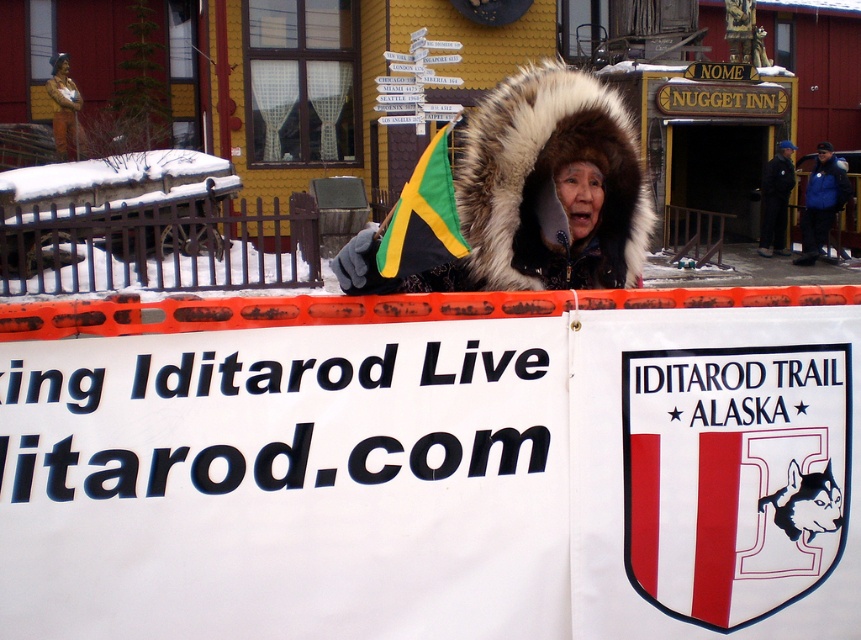
Which of these two, white paper sign at center or black fabric jacket at upper right, stands taller?

With more height is black fabric jacket at upper right.

Does white paper sign at center have a larger size compared to black fabric jacket at upper right?

No.

Between point (57, 352) and point (777, 195), which one is positioned in front?

Positioned in front is point (57, 352).

The width and height of the screenshot is (861, 640). What are the coordinates of `white paper sign at center` in the screenshot? It's located at (286, 483).

Which of these two, white paper sign at center or matte bronze statue at upper left, stands shorter?

white paper sign at center

Can you confirm if white paper sign at center is taller than matte bronze statue at upper left?

No.

I want to click on white paper sign at center, so click(286, 483).

Which of these two, blue fleece jacket at upper right or matte bronze statue at upper left, stands taller?

Standing taller between the two is matte bronze statue at upper left.

Is blue fleece jacket at upper right positioned before matte bronze statue at upper left?

Yes, it is in front of matte bronze statue at upper left.

What do you see at coordinates (821, 202) in the screenshot? The height and width of the screenshot is (640, 861). I see `blue fleece jacket at upper right` at bounding box center [821, 202].

Find the location of a particular element. blue fleece jacket at upper right is located at coordinates (821, 202).